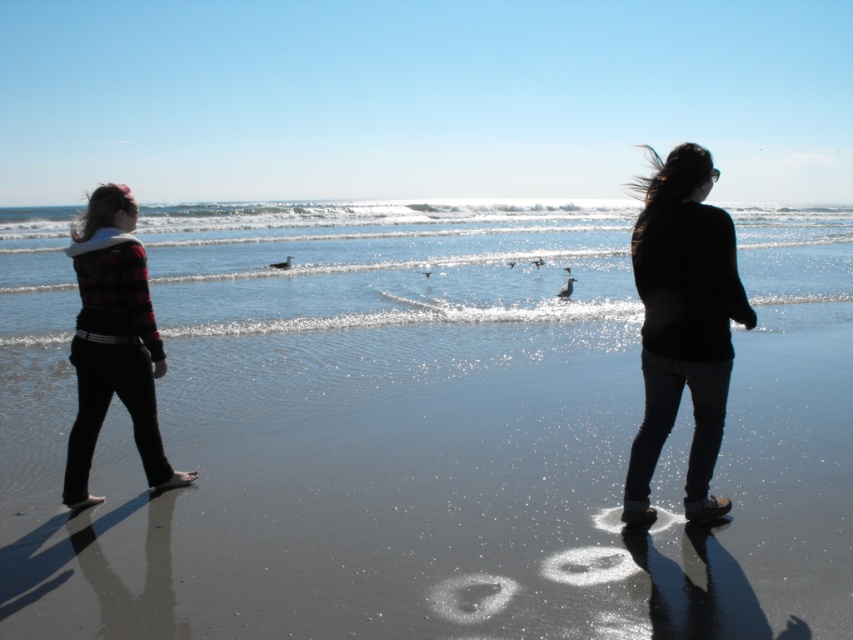
Based on the photo, is clear water at center closer to the viewer compared to plaid fabric jacket at left?

No.

Between clear water at center and plaid fabric jacket at left, which one appears on the right side from the viewer's perspective?

clear water at center

Between point (606, 268) and point (126, 273), which one is positioned in front?

Point (126, 273)

Find the location of `clear water at center`. clear water at center is located at coordinates [x=384, y=264].

Does clear water at center have a greater height compared to black matte sweater at center?

Yes, clear water at center is taller than black matte sweater at center.

Who is higher up, clear water at center or black matte sweater at center?

clear water at center is above.

What do you see at coordinates (384, 264) in the screenshot? I see `clear water at center` at bounding box center [384, 264].

Identify the location of clear water at center. (384, 264).

Which is below, smooth sand at center or plaid fabric jacket at left?

Positioned lower is smooth sand at center.

Is point (467, 412) positioned in front of point (106, 208)?

No, it is not.

Identify the location of smooth sand at center. The height and width of the screenshot is (640, 853). 457,512.